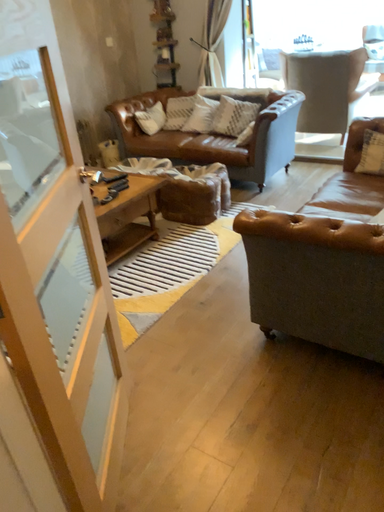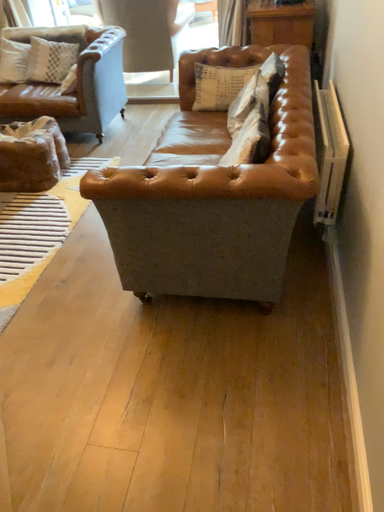
Question: How did the camera likely rotate when shooting the video?

Choices:
 (A) rotated right
 (B) rotated left

Answer: (A)